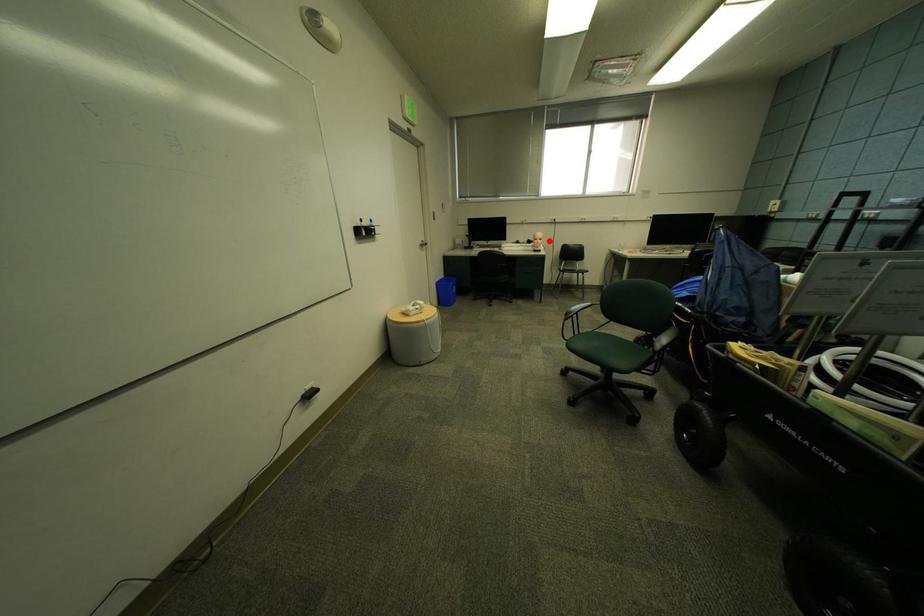
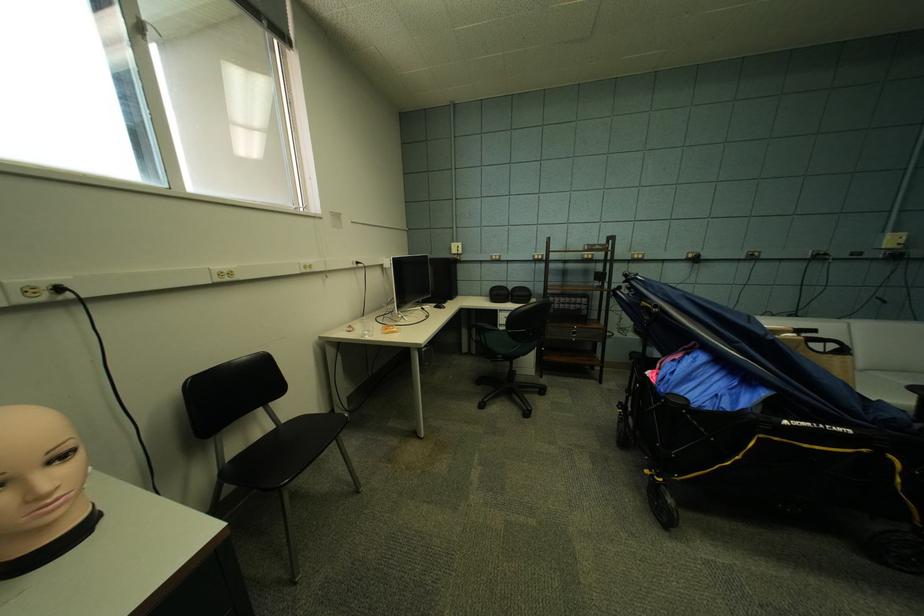
Question: I am providing you with two images of the same scene from different viewpoints. A red point is shown in image1. For the corresponding object point in image2, is it positioned nearer or farther from the camera?

Choices:
 (A) Nearer
 (B) Farther

Answer: (B)